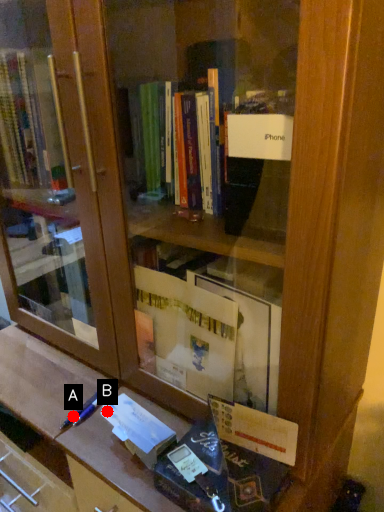
Question: Two points are circled on the image, labeled by A and B beside each circle. Among these points, which one is nearest to the camera?

Choices:
 (A) A is closer
 (B) B is closer

Answer: (B)